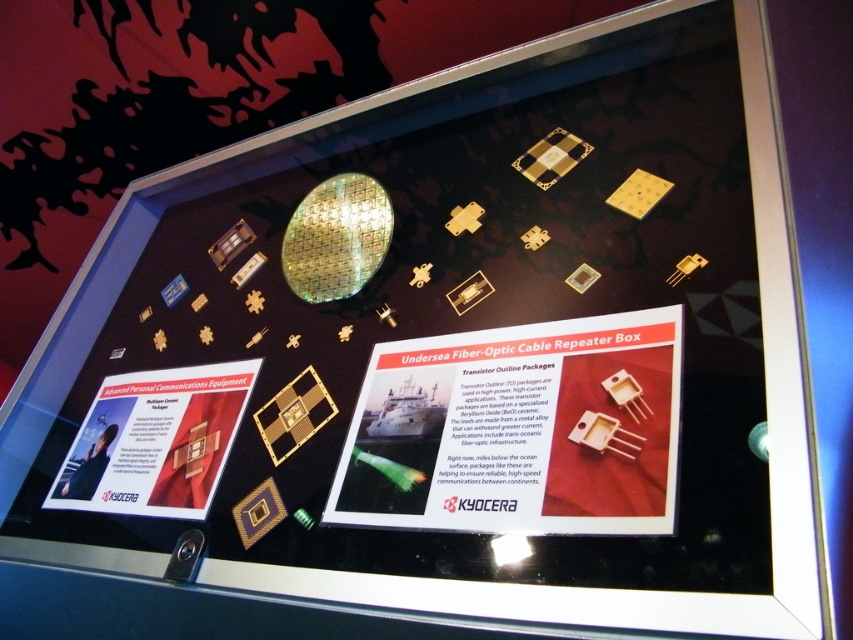
Question: Can you confirm if white paper at center is wider than gold metallic square at center?

Choices:
 (A) yes
 (B) no

Answer: (A)

Question: Which object appears closest to the camera in this image?

Choices:
 (A) gold metallic square at center
 (B) white glossy poster at lower left

Answer: (A)

Question: Is white paper at center above white glossy poster at lower left?

Choices:
 (A) no
 (B) yes

Answer: (B)

Question: Which point is closer to the camera?

Choices:
 (A) (637, 476)
 (B) (120, 477)

Answer: (A)

Question: Does white paper at center have a larger size compared to white glossy poster at lower left?

Choices:
 (A) yes
 (B) no

Answer: (A)

Question: Which point appears farthest from the camera in this image?

Choices:
 (A) (125, 513)
 (B) (613, 358)
 (C) (273, 412)

Answer: (A)